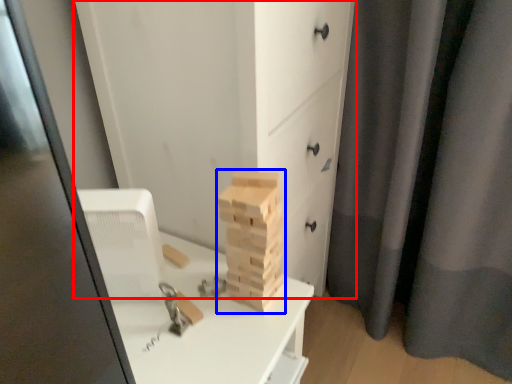
Question: Which of the following is the farthest to the observer, chest of drawers (highlighted by a red box) or drawer (highlighted by a blue box)?

Choices:
 (A) chest of drawers
 (B) drawer

Answer: (B)